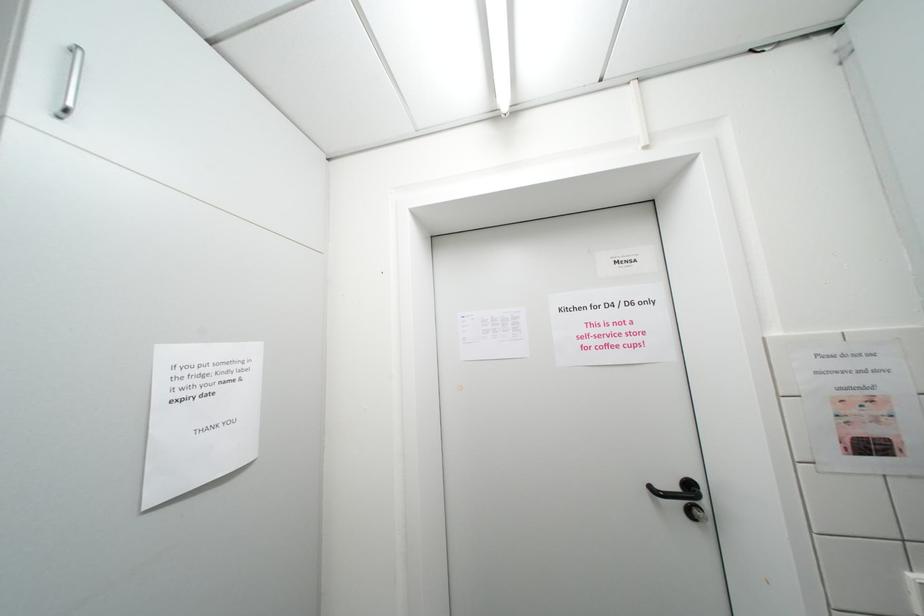
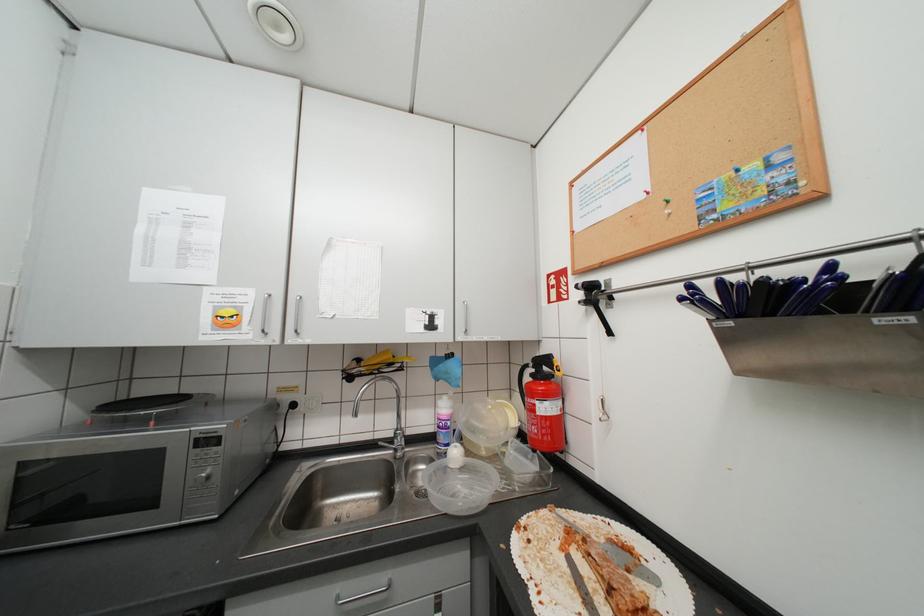
Question: How did the camera likely rotate?

Choices:
 (A) Left
 (B) Right
 (C) Up
 (D) Down

Answer: (B)